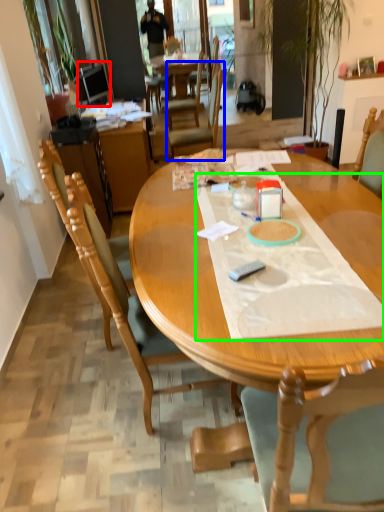
Question: Which is nearer to the television (highlighted by a red box)? chair (highlighted by a blue box) or sheet (highlighted by a green box).

Choices:
 (A) chair
 (B) sheet

Answer: (A)